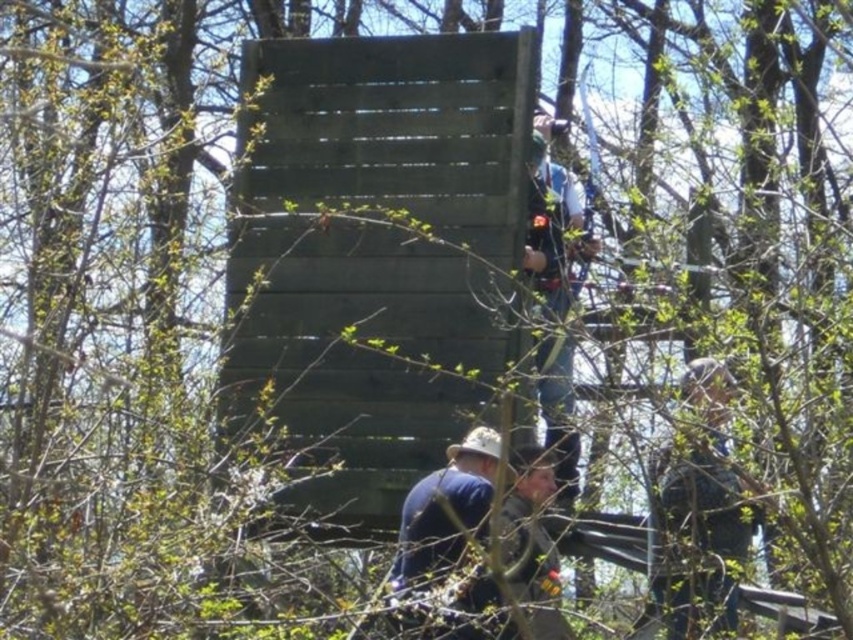
Question: Observing the image, what is the correct spatial positioning of dark wood lift at center in reference to blue denim jeans at upper right?

Choices:
 (A) left
 (B) right

Answer: (A)

Question: Estimate the real-world distances between objects in this image. Which object is farther from the dark wood lift at center?

Choices:
 (A) blue denim jeans at upper right
 (B) blue fabric hat at lower center

Answer: (A)

Question: Can you confirm if dark wood lift at center is bigger than blue fabric hat at lower center?

Choices:
 (A) no
 (B) yes

Answer: (A)

Question: Among these objects, which one is farthest from the camera?

Choices:
 (A) dark wood lift at center
 (B) blue denim jeans at upper right
 (C) blue fabric hat at lower center

Answer: (B)

Question: Among these points, which one is nearest to the camera?

Choices:
 (A) (401, 513)
 (B) (660, 566)
 (C) (544, 276)
 (D) (355, 362)

Answer: (B)

Question: Is dark wood lift at center above camouflage fabric construction worker at right?

Choices:
 (A) yes
 (B) no

Answer: (B)